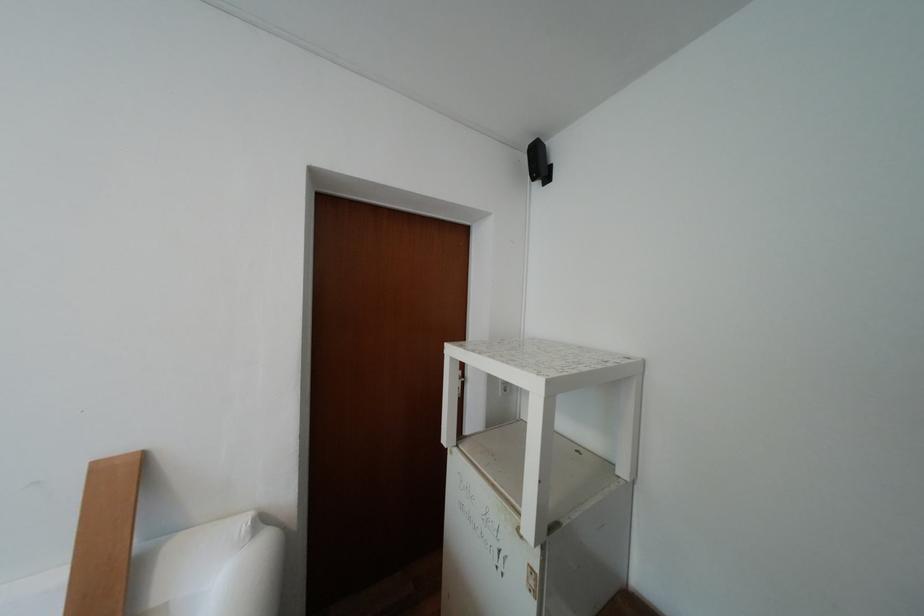
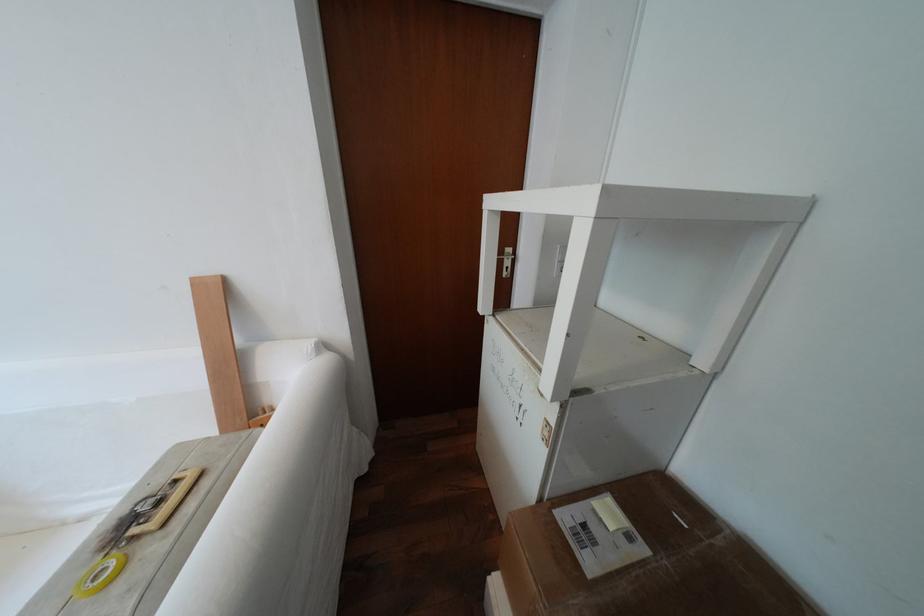
The images are taken continuously from a first-person perspective. In which direction are you moving?

The movement direction of the cameraman is right, forward.